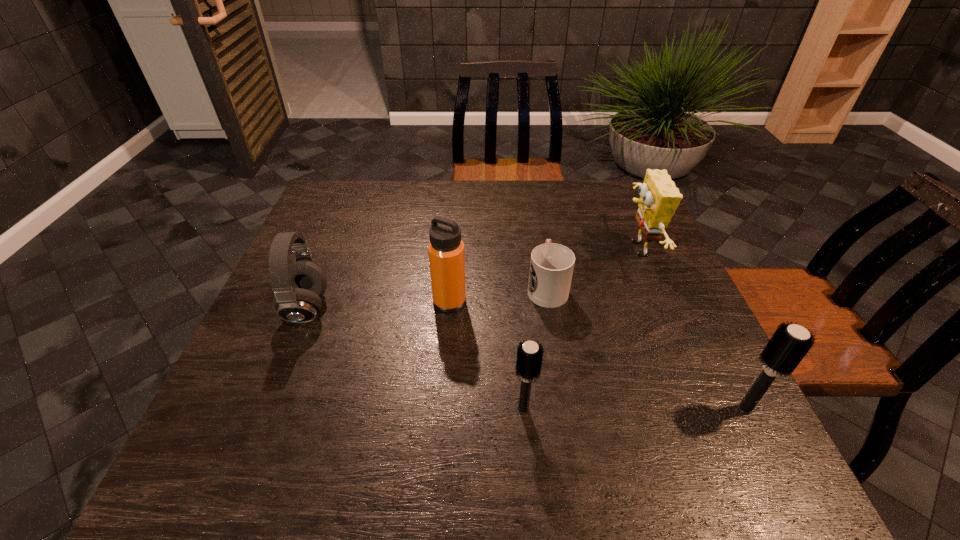
You are a GUI agent. You are given a task and a screenshot of the screen. Output one action in this format:
    pyautogui.click(x=<x>, y=<y>)
    Task: Click on the object situated at the left edge
    
    Given the screenshot: What is the action you would take?
    [x=297, y=287]

I want to click on hairbrush present at the right edge, so click(789, 344).

Identify the location of sponge at the right edge. This screenshot has height=540, width=960. pyautogui.click(x=659, y=197).

Where is `object that is at the far right corner`? object that is at the far right corner is located at coordinates (659, 197).

Where is `object that is at the near right corner`? This screenshot has width=960, height=540. object that is at the near right corner is located at coordinates (789, 344).

Find the location of a particular element. vacant area at the far edge is located at coordinates (585, 215).

In the image, there is a desktop. Where is `free space at the near edge`? Image resolution: width=960 pixels, height=540 pixels. free space at the near edge is located at coordinates (370, 407).

In the image, there is a desktop. At what (x,y) coordinates should I click in order to perform the action: click on free space at the left edge. Please return your answer as a coordinate pair (x, y). The width and height of the screenshot is (960, 540). Looking at the image, I should click on (269, 314).

In the image, there is a desktop. In order to click on vacant space at the right edge in this screenshot , I will do pos(658,288).

At what (x,y) coordinates should I click in order to perform the action: click on free space at the far left corner. Please return your answer as a coordinate pair (x, y). Looking at the image, I should click on tap(353, 213).